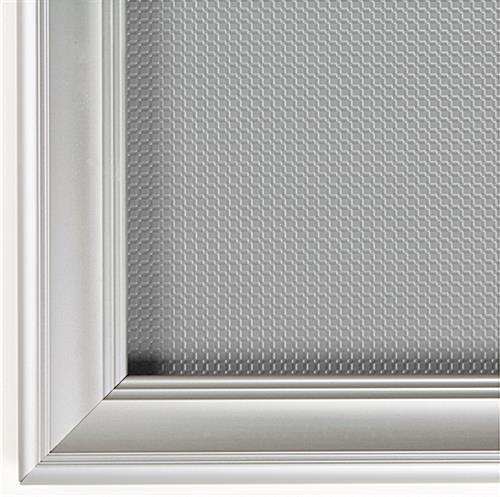
At what (x,y) coordinates should I click in order to perform the action: click on grooves in frame. Please return your answer as a coordinate pair (x, y). Looking at the image, I should click on (169, 461), (43, 162), (113, 108), (286, 386).